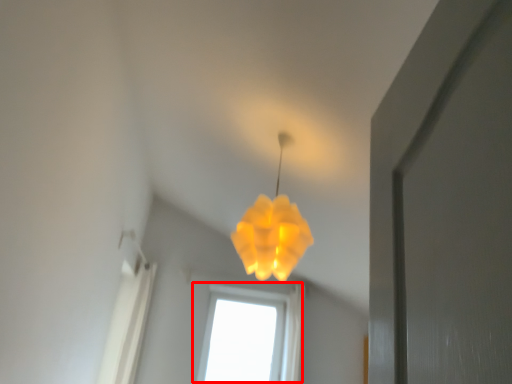
Question: From the image's perspective, where is window (annotated by the red box) located relative to lamp?

Choices:
 (A) above
 (B) below

Answer: (B)